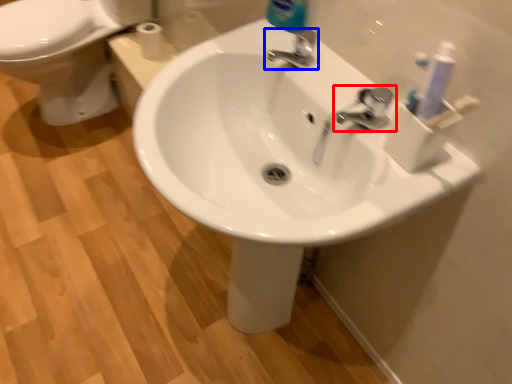
Question: Among these objects, which one is nearest to the camera, tap (highlighted by a red box) or tap (highlighted by a blue box)?

Choices:
 (A) tap
 (B) tap

Answer: (A)